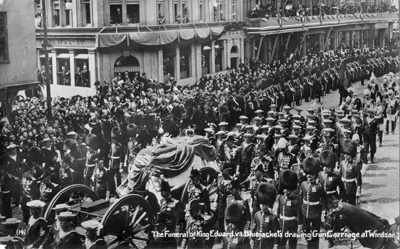
At what (x,y) coordinates should I click in order to perform the action: click on window. Please return your answer as a coordinate pair (x, y). Image resolution: width=400 pixels, height=249 pixels. Looking at the image, I should click on (170, 68).